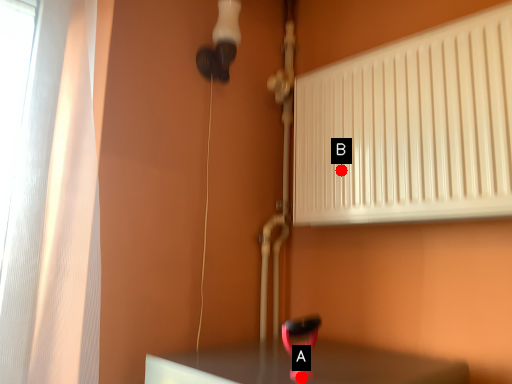
Question: Two points are circled on the image, labeled by A and B beside each circle. Which point is closer to the camera taking this photo?

Choices:
 (A) A is closer
 (B) B is closer

Answer: (A)